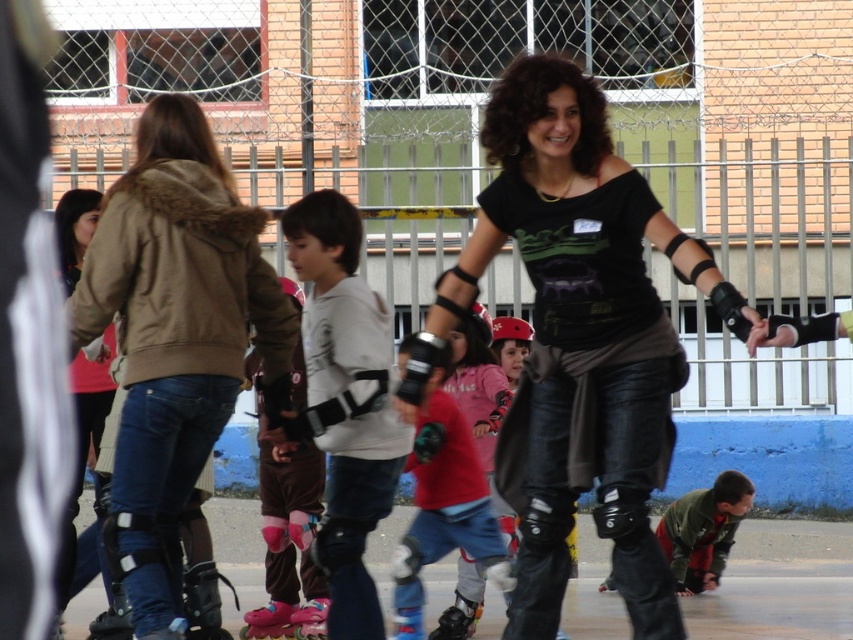
Between point (154, 228) and point (746, 493), which one is positioned behind?

The point (746, 493) is behind.

Find the location of `matte brown jacket at center`. matte brown jacket at center is located at coordinates [x=177, y=337].

From the picture: Who is more forward, (194, 412) or (722, 516)?

Positioned in front is point (194, 412).

I want to click on matte brown jacket at center, so click(177, 337).

Is matte brown jacket at center above black matte roller skate at lower left?

Yes.

You are a GUI agent. You are given a task and a screenshot of the screen. Output one action in this format:
    pyautogui.click(x=<x>, y=<y>)
    Task: Click on the matte brown jacket at center
    
    Given the screenshot: What is the action you would take?
    pyautogui.click(x=177, y=337)

Is point (129, 288) less distant than point (199, 628)?

Yes, it is in front of point (199, 628).

At what (x,y) coordinates should I click in order to perform the action: click on matte brown jacket at center. Please return your answer as a coordinate pair (x, y). Image resolution: width=853 pixels, height=640 pixels. Looking at the image, I should click on (177, 337).

Does black matte roller skate at lower left appear under pink rubber roller skate at lower center?

No, black matte roller skate at lower left is not below pink rubber roller skate at lower center.

Is black matte roller skate at lower left to the right of pink rubber roller skate at lower center from the viewer's perspective?

No, black matte roller skate at lower left is not to the right of pink rubber roller skate at lower center.

Who is more distant from viewer, (x=194, y=620) or (x=271, y=632)?

Point (x=271, y=632)

Where is `black matte roller skate at lower left`? black matte roller skate at lower left is located at coordinates (204, 602).